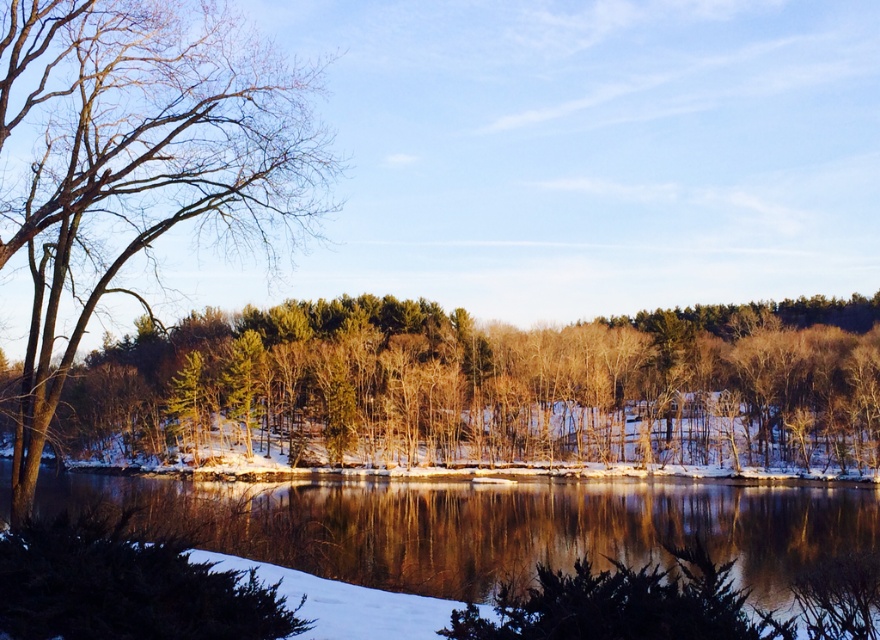
You are standing in the winter landscape and want to walk from the green matte tree at center to the glossy reflective water at center. Which direction should you move to get closer to the water?

You should move away from the green matte tree at center towards the glossy reflective water at center since the green matte tree at center is closer to you than the glossy reflective water at center.

You are a photographer trying to capture a wide shot of the green matte tree at center and the glossy reflective water at center. Based on their widths, which one should you focus on to ensure both fit in the frame?

The green matte tree at center might be wider than glossy reflective water at center, so focusing on the tree would ensure both fit in the frame.